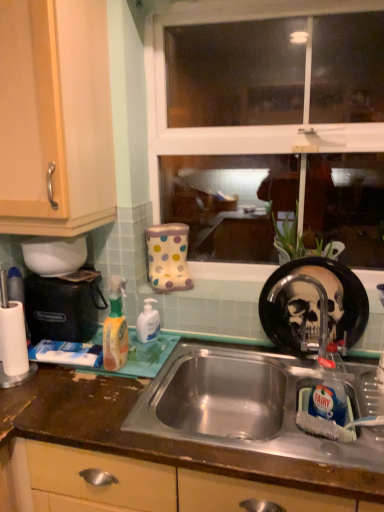
At what (x,y) coordinates should I click in order to perform the action: click on space that is in front of brushed metal faucet at sink right. Please return your answer as a coordinate pair (x, y). The height and width of the screenshot is (512, 384). Looking at the image, I should click on (x=319, y=393).